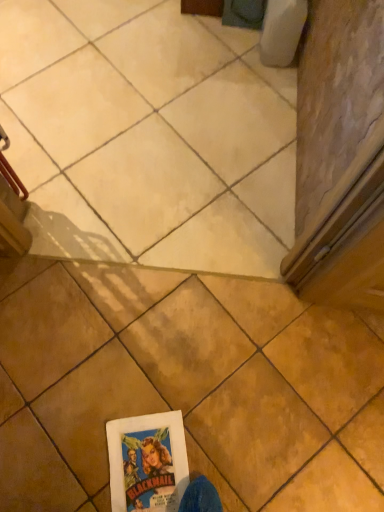
Question: In which direction should I rotate to look at brown matte tile at center, placed as the 2th tile when sorted from back to front?

Choices:
 (A) right
 (B) left

Answer: (B)

Question: Which direction should I rotate to look at matte beige tile at center, arranged as the 2th tile when ordered from the bottom, — up or down?

Choices:
 (A) up
 (B) down

Answer: (A)

Question: Is matte beige tile at center, arranged as the 2th tile when ordered from the bottom, further to camera compared to brown matte tile at center, the 2th tile in the top-to-bottom sequence?

Choices:
 (A) yes
 (B) no

Answer: (A)

Question: Is matte beige tile at center, arranged as the 2th tile when ordered from the bottom, at the right side of brown matte tile at center, which appears as the first tile when ordered from the bottom?

Choices:
 (A) no
 (B) yes

Answer: (A)

Question: Does matte beige tile at center, arranged as the 2th tile when ordered from the bottom, touch brown matte tile at center, which appears as the first tile when ordered from the bottom?

Choices:
 (A) yes
 (B) no

Answer: (B)

Question: Is matte beige tile at center, arranged as the 2th tile when ordered from the bottom, not close to brown matte tile at center, the 1th tile when ordered from front to back?

Choices:
 (A) no
 (B) yes

Answer: (A)

Question: From the image's perspective, would you say matte beige tile at center, the 1th tile when ordered from back to front, is shown under brown matte tile at center, the 1th tile when ordered from front to back?

Choices:
 (A) yes
 (B) no

Answer: (B)

Question: From the image's perspective, does matte beige tile at center, arranged as the 2th tile when ordered from the bottom, appear higher than brown matte tile at center, the 1th tile when ordered from front to back?

Choices:
 (A) yes
 (B) no

Answer: (A)

Question: From a real-world perspective, does brown matte tile at center, placed as the 2th tile when sorted from back to front, stand above matte beige tile at center, which is the second tile in front-to-back order?

Choices:
 (A) no
 (B) yes

Answer: (B)

Question: From a real-world perspective, is brown matte tile at center, placed as the 2th tile when sorted from back to front, physically below matte beige tile at center, arranged as the 2th tile when ordered from the bottom?

Choices:
 (A) yes
 (B) no

Answer: (B)

Question: Considering the relative sizes of brown matte tile at center, placed as the 2th tile when sorted from back to front, and matte beige tile at center, acting as the 1th tile starting from the top, in the image provided, is brown matte tile at center, placed as the 2th tile when sorted from back to front, shorter than matte beige tile at center, acting as the 1th tile starting from the top,?

Choices:
 (A) no
 (B) yes

Answer: (A)

Question: Considering the relative sizes of brown matte tile at center, placed as the 2th tile when sorted from back to front, and matte beige tile at center, the 1th tile when ordered from back to front, in the image provided, is brown matte tile at center, placed as the 2th tile when sorted from back to front, thinner than matte beige tile at center, the 1th tile when ordered from back to front,?

Choices:
 (A) no
 (B) yes

Answer: (B)

Question: Considering the relative sizes of brown matte tile at center, the 1th tile when ordered from front to back, and matte beige tile at center, which is the second tile in front-to-back order, in the image provided, is brown matte tile at center, the 1th tile when ordered from front to back, taller than matte beige tile at center, which is the second tile in front-to-back order,?

Choices:
 (A) no
 (B) yes

Answer: (B)

Question: Does brown matte tile at center, placed as the 2th tile when sorted from back to front, touch matte beige tile at center, arranged as the 2th tile when ordered from the bottom?

Choices:
 (A) yes
 (B) no

Answer: (B)

Question: From a real-world perspective, is matte beige tile at center, acting as the 1th tile starting from the top, physically located above or below brown matte tile at center, placed as the 2th tile when sorted from back to front?

Choices:
 (A) above
 (B) below

Answer: (B)